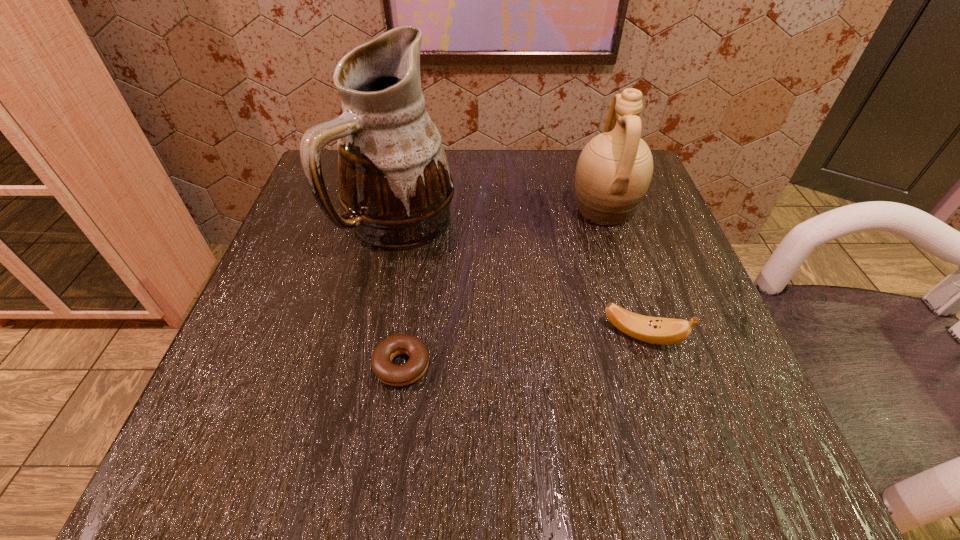
The width and height of the screenshot is (960, 540). In order to click on object that is at the left edge in this screenshot , I will do `click(395, 185)`.

Image resolution: width=960 pixels, height=540 pixels. I want to click on pitcher located at the right edge, so pyautogui.click(x=614, y=170).

Locate an element on the screen. The image size is (960, 540). banana at the right edge is located at coordinates (663, 331).

Find the location of `object at the far left corner`. object at the far left corner is located at coordinates (395, 185).

Identify the location of object that is at the far right corner. (614, 170).

In the image, there is a desktop. Find the location of `free space at the far edge`. free space at the far edge is located at coordinates (447, 158).

In the image, there is a desktop. Where is `vacant space at the near edge`? vacant space at the near edge is located at coordinates (425, 432).

Identify the location of free spot at the left edge of the desktop. coord(281,369).

In order to click on vacant space at the right edge of the desktop in this screenshot , I will do `click(674, 248)`.

Identify the location of free location at the far left corner of the desktop. (327, 186).